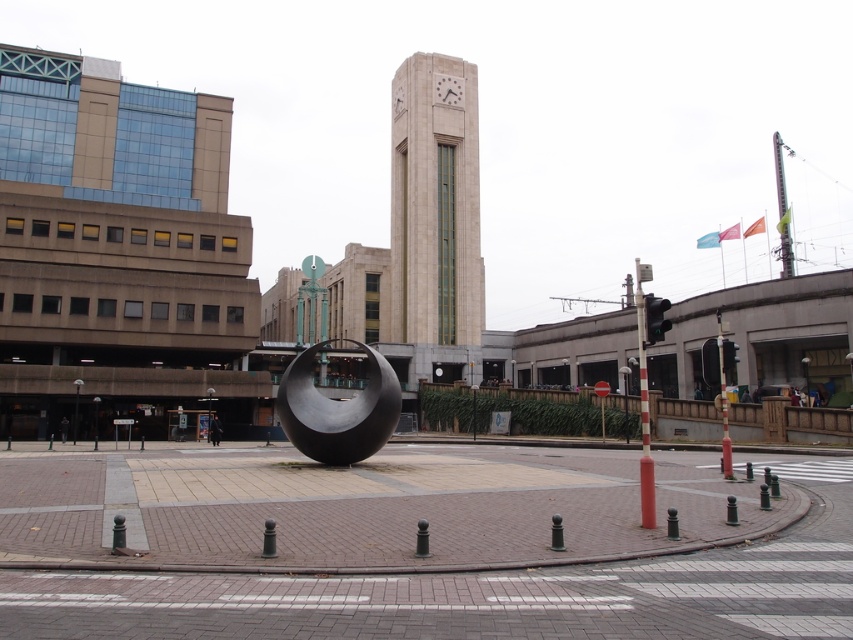
Question: Is beige stone clock tower at center further to camera compared to polished metal sphere at center?

Choices:
 (A) no
 (B) yes

Answer: (B)

Question: Which of the following is the farthest from the observer?

Choices:
 (A) (x=329, y=413)
 (B) (x=436, y=102)

Answer: (B)

Question: Which point is closer to the camera taking this photo?

Choices:
 (A) (399, 337)
 (B) (367, 394)

Answer: (B)

Question: Which object is closer to the camera taking this photo?

Choices:
 (A) polished metal sphere at center
 (B) beige stone clock tower at center

Answer: (A)

Question: Does beige stone clock tower at center lie behind polished metal sphere at center?

Choices:
 (A) yes
 (B) no

Answer: (A)

Question: Does beige stone clock tower at center have a greater width compared to polished metal sphere at center?

Choices:
 (A) yes
 (B) no

Answer: (B)